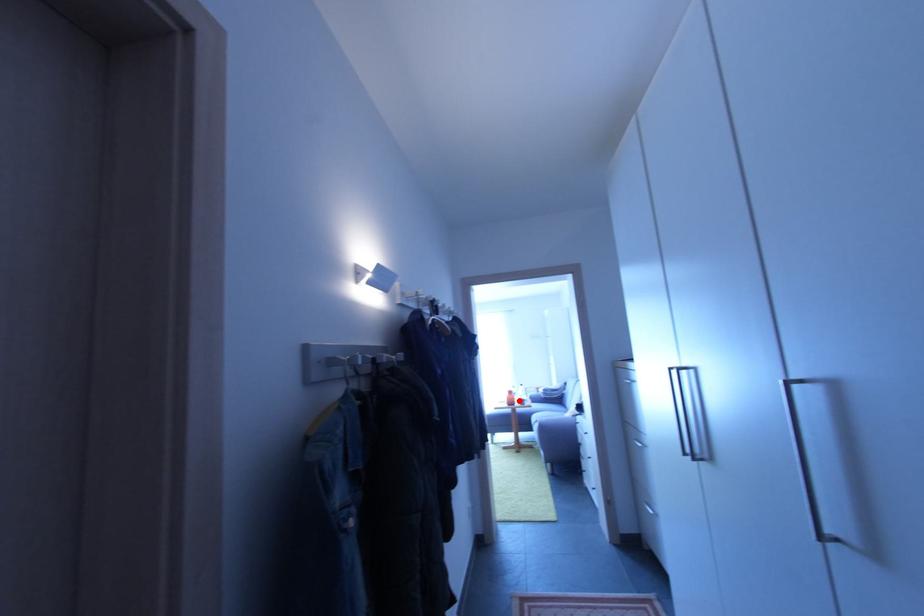
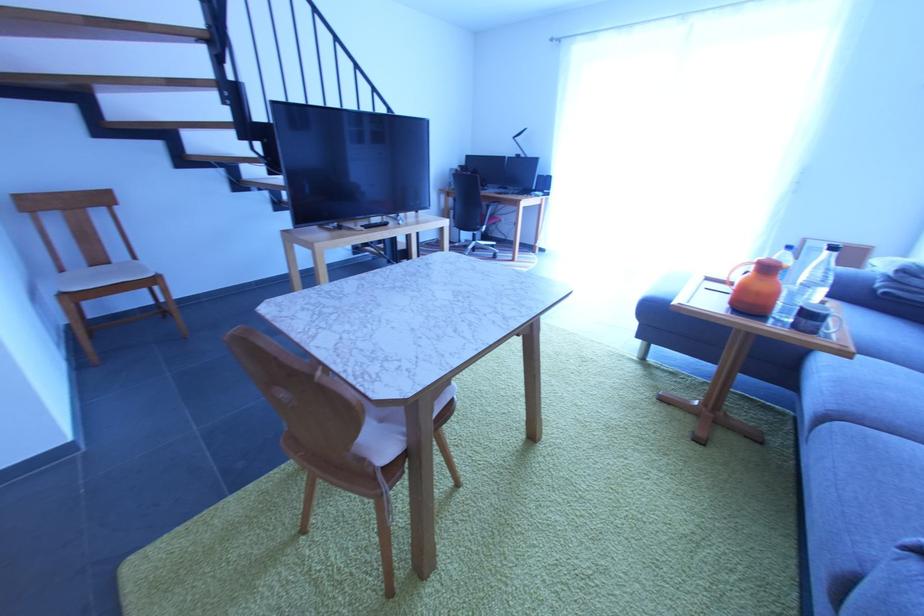
Question: A red point is marked in image1. In image2, is the corresponding 3D point closer to the camera or farther? Reply with the corresponding letter.

Choices:
 (A) The corresponding 3D point is closer.
 (B) The corresponding 3D point is farther.

Answer: (A)